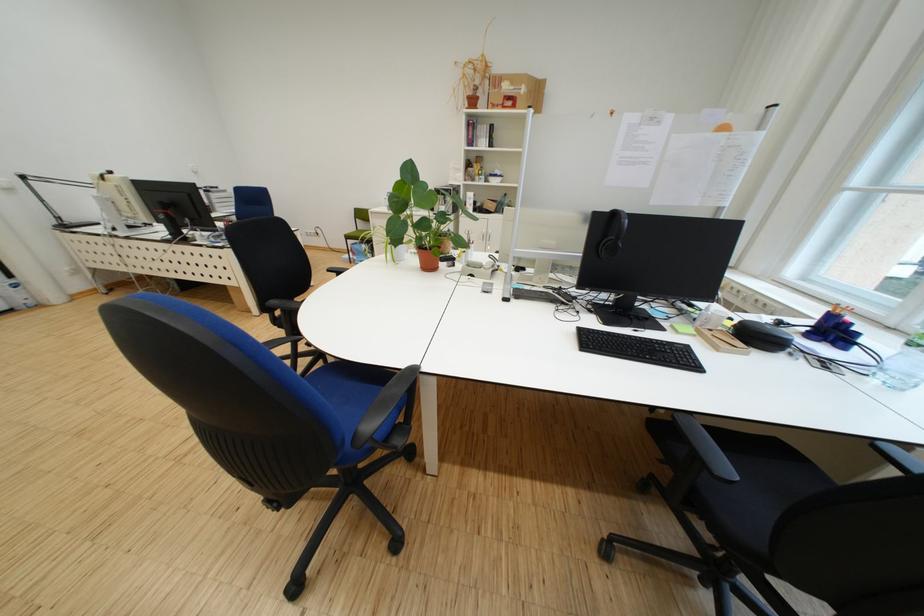
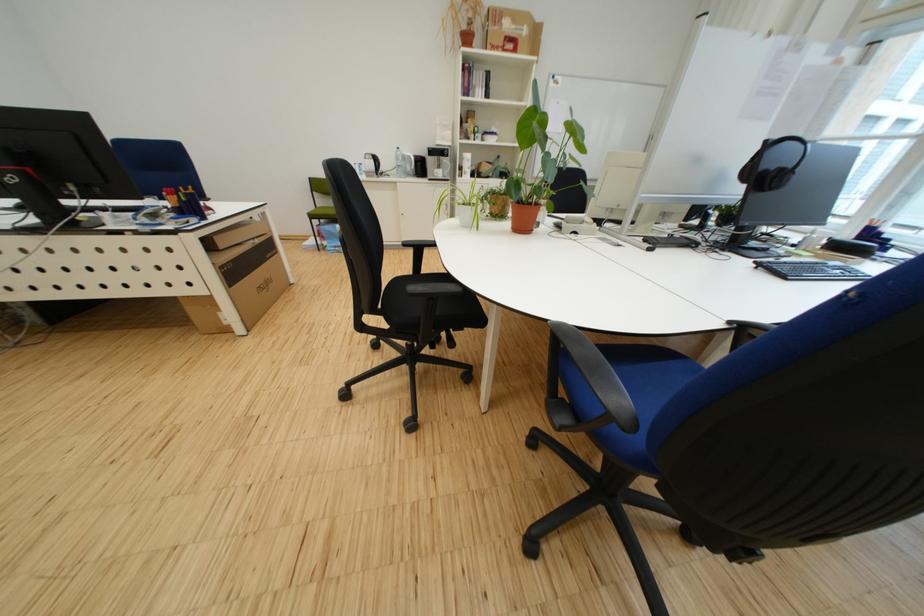
What movement of the cameraman would produce the second image?

The movement direction of the cameraman is left, forward.